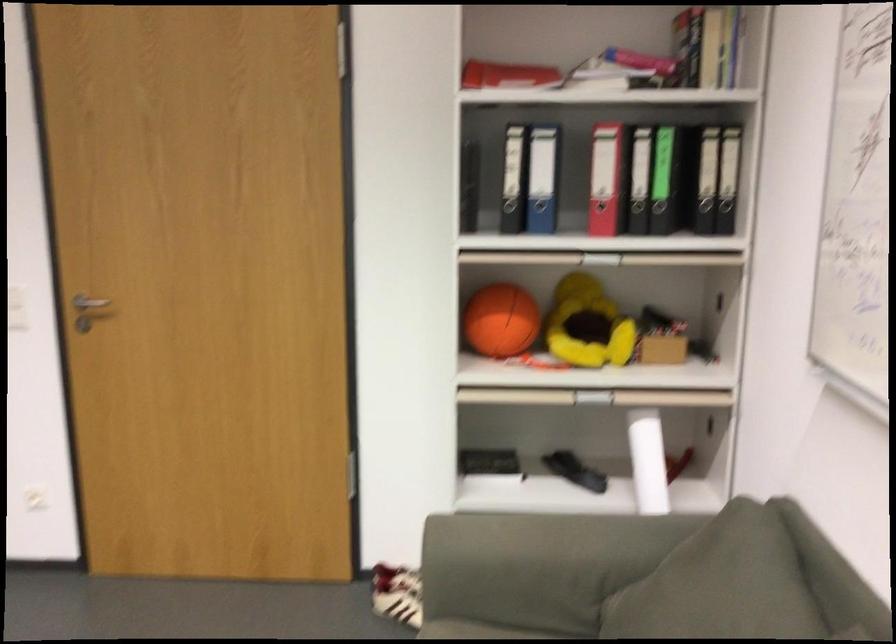
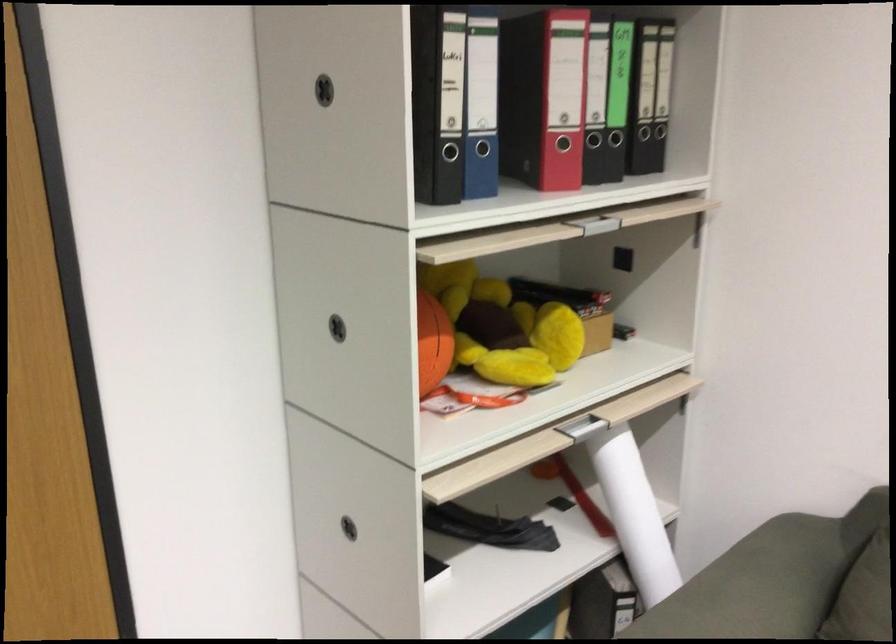
Where in the second image is the point corresponding to the point at 760,301 from the first image?

(743, 260)